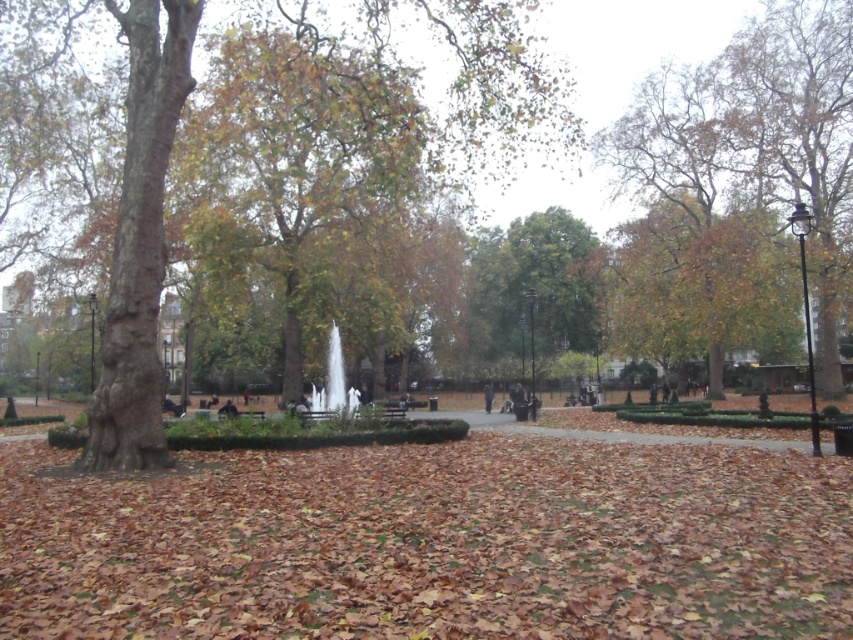
Looking at this image, you are a photographer planning to capture the entire view of the park, including both the brown leafy tree at upper right and the white marble fountain at center. Based on their sizes, which object would require more space in your camera frame?

The brown leafy tree at upper right requires more space in the camera frame because its width is larger than the white marble fountain at center.

You are planning to place a new bench in the park. The bench requires a space that is wider than the white marble fountain at center. Can the area near the green leafy tree at center accommodate this bench?

The green leafy tree at center has a width larger than the white marble fountain at center. Since the bench requires a space wider than the fountain, the area near the green leafy tree at center can accommodate the bench as its width is sufficient.

You are standing in the park and want to take a photo of the brown leafy tree at upper right. If your camera has a maximum zoom range of 20 meters, will you be able to capture the tree clearly without moving closer?

The brown leafy tree at upper right is 31.48 meters away from the viewer. Since the camera can only zoom up to 20 meters, you won cannot capture the tree clearly without moving closer.